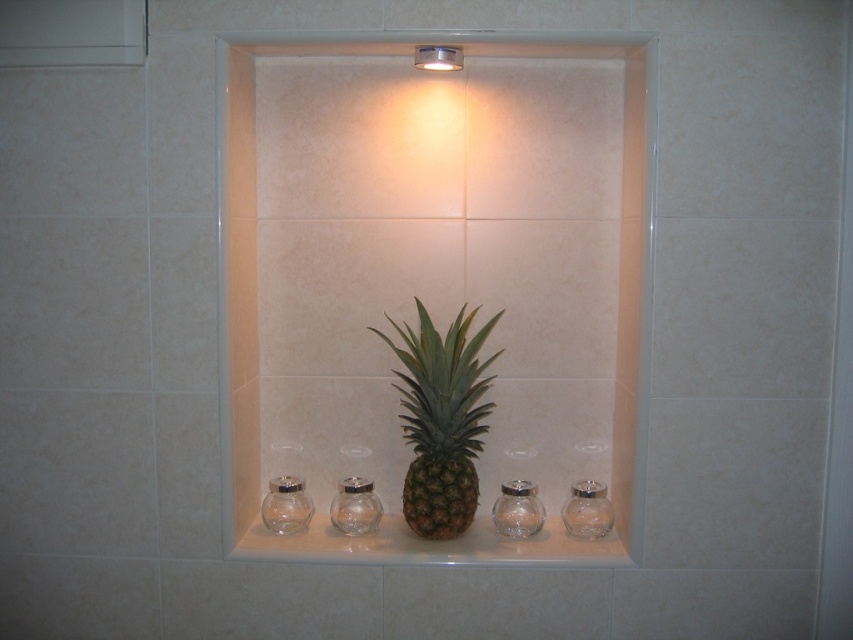
Question: Which of these objects is positioned closest to the transparent glass jar at lower right?

Choices:
 (A) transparent glass jar at lower left
 (B) green matte pineapple at center
 (C) clear glass pineapple at center

Answer: (C)

Question: Does green matte pineapple at center lie behind transparent glass jar at lower left?

Choices:
 (A) no
 (B) yes

Answer: (A)

Question: Among these points, which one is nearest to the camera?

Choices:
 (A) (509, 328)
 (B) (331, 509)

Answer: (B)

Question: Which of the following is the closest to the observer?

Choices:
 (A) (436, 420)
 (B) (527, 481)

Answer: (A)

Question: Can you confirm if green matte pineapple at center is positioned above transparent glass jar at center?

Choices:
 (A) yes
 (B) no

Answer: (A)

Question: Does greenish-brown glass pineapple at center lie in front of transparent glass jar at lower left?

Choices:
 (A) yes
 (B) no

Answer: (A)